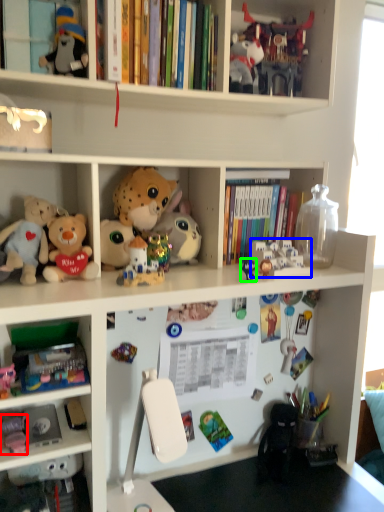
Question: Based on their relative distances, which object is nearer to toy (highlighted by a red box)? Choose from toy (highlighted by a blue box) and toy (highlighted by a green box).

Choices:
 (A) toy
 (B) toy

Answer: (B)